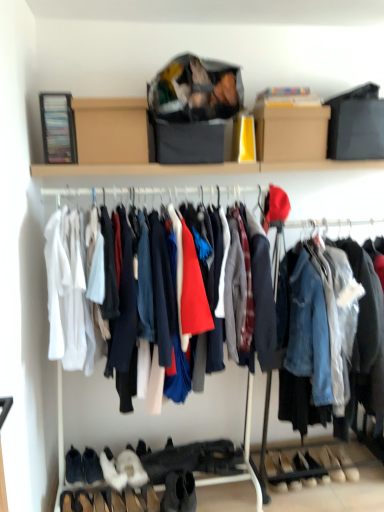
Question: Can you confirm if white suede shoe at lower right, which is the eighth footwear in left-to-right order, is bigger than leather shoes at lower center, the 5th footwear positioned from the left?

Choices:
 (A) no
 (B) yes

Answer: (A)

Question: Is white suede shoe at lower right, which is the eighth footwear in left-to-right order, aimed at leather shoes at lower center, the 5th footwear positioned from the left?

Choices:
 (A) no
 (B) yes

Answer: (A)

Question: Is leather shoes at lower center, the 5th footwear positioned from the left, located within white suede shoe at lower right, which ranks as the first footwear in right-to-left order?

Choices:
 (A) yes
 (B) no

Answer: (B)

Question: Can you confirm if white suede shoe at lower right, which is the eighth footwear in left-to-right order, is taller than leather shoes at lower center, placed as the fourth footwear when sorted from right to left?

Choices:
 (A) yes
 (B) no

Answer: (B)

Question: Is white suede shoe at lower right, which is the eighth footwear in left-to-right order, looking in the opposite direction of leather shoes at lower center, the 5th footwear positioned from the left?

Choices:
 (A) yes
 (B) no

Answer: (B)

Question: Considering the relative sizes of white suede shoe at lower right, which is the eighth footwear in left-to-right order, and leather shoes at lower center, the 5th footwear positioned from the left, in the image provided, is white suede shoe at lower right, which is the eighth footwear in left-to-right order, shorter than leather shoes at lower center, the 5th footwear positioned from the left,?

Choices:
 (A) no
 (B) yes

Answer: (B)

Question: Can you confirm if white suede shoes at lower center, placed as the 3th footwear when sorted from right to left, is wider than leather beige shoe at lower center, the 2th shoe from the right?

Choices:
 (A) no
 (B) yes

Answer: (A)

Question: Is white suede shoes at lower center, arranged as the sixth footwear when viewed from the left, touching leather beige shoe at lower center, the 2th shoe from the right?

Choices:
 (A) yes
 (B) no

Answer: (B)

Question: Is white suede shoes at lower center, placed as the 3th footwear when sorted from right to left, positioned behind leather beige shoe at lower center, the 1th shoe in the left-to-right sequence?

Choices:
 (A) yes
 (B) no

Answer: (A)

Question: Is white suede shoes at lower center, placed as the 3th footwear when sorted from right to left, at the left side of leather beige shoe at lower center, the 1th shoe in the left-to-right sequence?

Choices:
 (A) no
 (B) yes

Answer: (A)

Question: Is white suede shoes at lower center, arranged as the sixth footwear when viewed from the left, positioned in front of leather beige shoe at lower center, the 2th shoe from the right?

Choices:
 (A) no
 (B) yes

Answer: (A)

Question: Would you say leather beige shoe at lower center, the 2th shoe from the right, is part of white suede shoes at lower center, placed as the 3th footwear when sorted from right to left,'s contents?

Choices:
 (A) no
 (B) yes

Answer: (A)

Question: Is black suede boot at lower left, the 1th footwear in the left-to-right sequence, positioned beyond the bounds of white suede boot at lower left, which is the second footwear in left-to-right order?

Choices:
 (A) no
 (B) yes

Answer: (B)